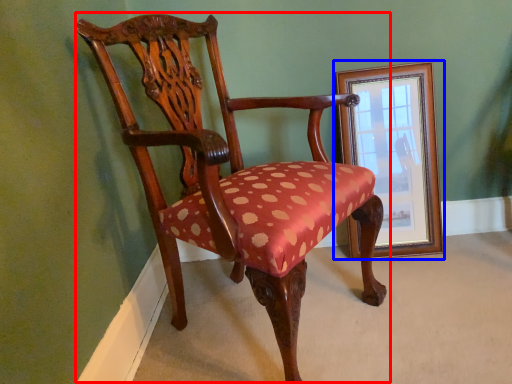
Question: Which point is closer to the camera, chair (highlighted by a red box) or picture frame (highlighted by a blue box)?

Choices:
 (A) chair
 (B) picture frame

Answer: (A)